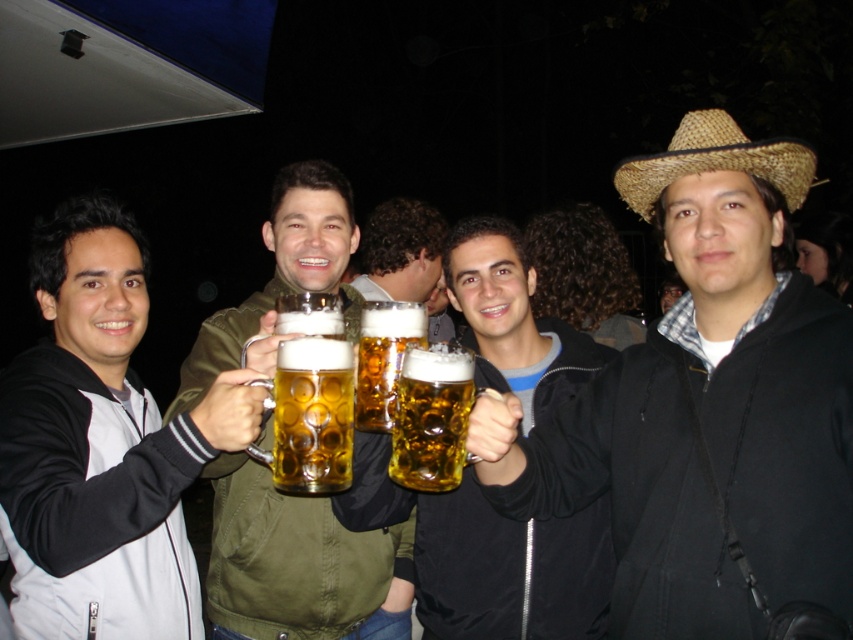
The width and height of the screenshot is (853, 640). Describe the element at coordinates (509, 570) in the screenshot. I see `shiny gold mug at center` at that location.

Image resolution: width=853 pixels, height=640 pixels. What do you see at coordinates (509, 570) in the screenshot?
I see `shiny gold mug at center` at bounding box center [509, 570].

Locate an element on the screen. shiny gold mug at center is located at coordinates (509, 570).

Can you confirm if shiny brass mug at center is shorter than straw hat at upper right?

No, shiny brass mug at center is not shorter than straw hat at upper right.

Who is more distant from viewer, (393, 596) or (630, 177)?

Point (393, 596)

Is point (213, 595) positioned behind point (711, 125)?

Yes, it is behind point (711, 125).

The image size is (853, 640). Identify the location of shiny brass mug at center. (299, 564).

Who is taller, golden glass mug at center or translucent glass mug at center?

With more height is translucent glass mug at center.

Describe the element at coordinates (431, 417) in the screenshot. I see `golden glass mug at center` at that location.

Identify the location of golden glass mug at center. (431, 417).